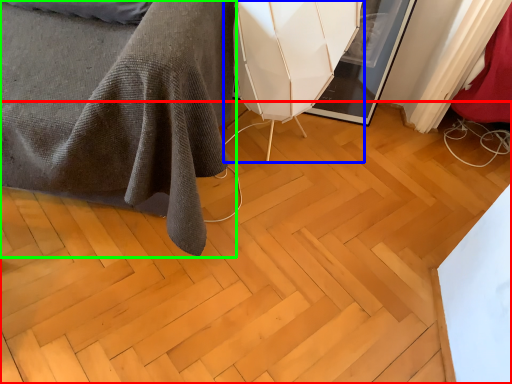
Question: Which is farther away from plywood (highlighted by a red box)? swivel chair (highlighted by a blue box) or furniture (highlighted by a green box)?

Choices:
 (A) swivel chair
 (B) furniture

Answer: (A)